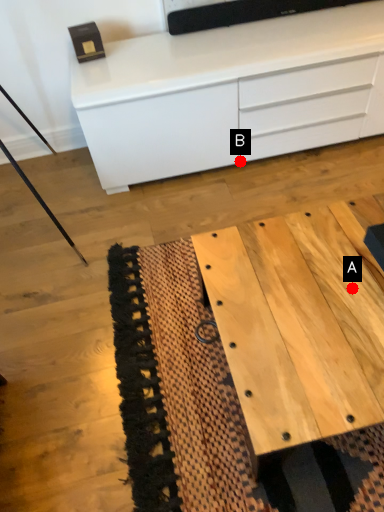
Question: Two points are circled on the image, labeled by A and B beside each circle. Which point is closer to the camera?

Choices:
 (A) A is closer
 (B) B is closer

Answer: (A)